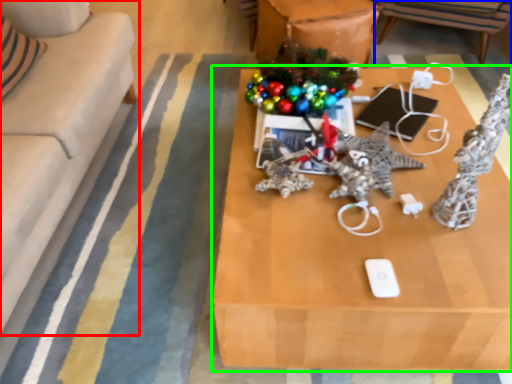
Question: Considering the real-world distances, which object is closest to studio couch (highlighted by a red box)? chair (highlighted by a blue box) or table (highlighted by a green box).

Choices:
 (A) chair
 (B) table

Answer: (B)